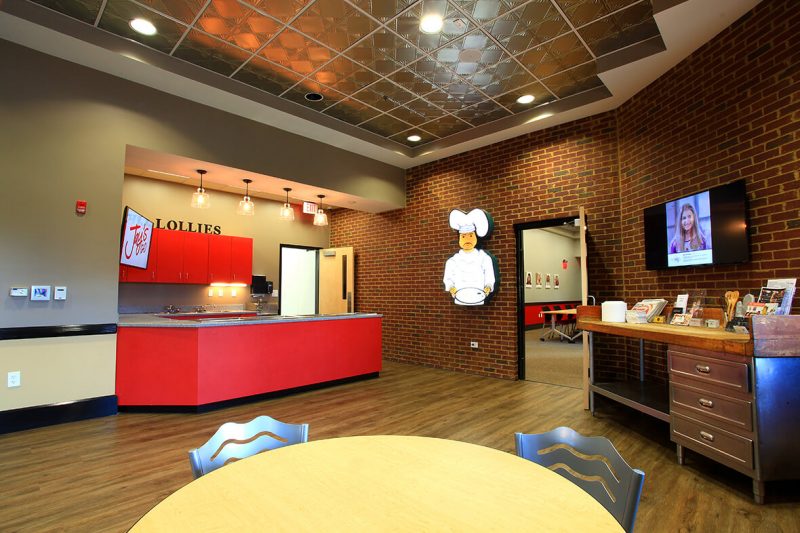
Locate an element on the screen. The width and height of the screenshot is (800, 533). round table is located at coordinates (417, 498).